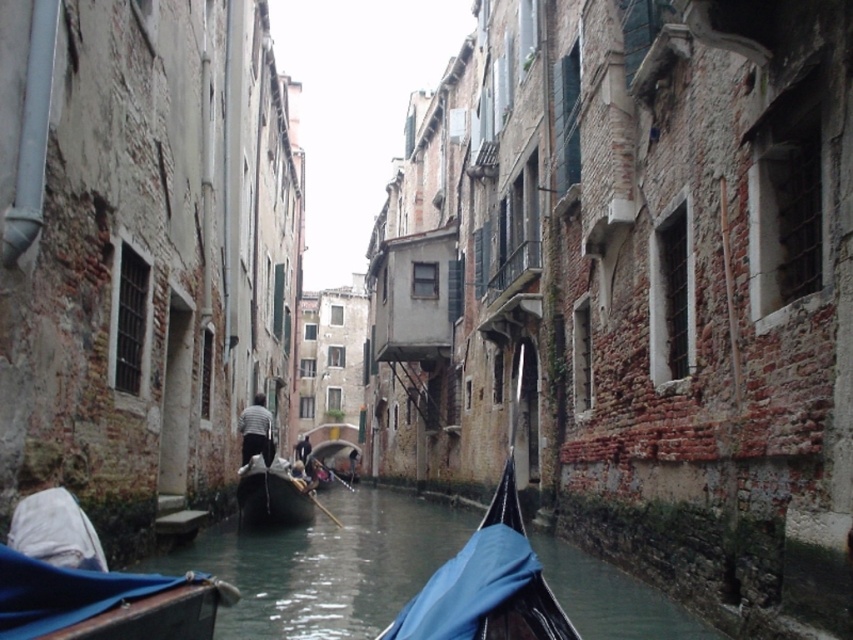
Question: Considering the real-world distances, which object is closest to the striped fabric shirt at center?

Choices:
 (A) blue fabric-covered boat at center
 (B) blue fabric boat at lower center
 (C) wooden gondola at center

Answer: (C)

Question: Can you confirm if white cloth at lower left is smaller than striped fabric shirt at center?

Choices:
 (A) yes
 (B) no

Answer: (A)

Question: Which point is closer to the camera?

Choices:
 (A) (251, 468)
 (B) (257, 432)
 (C) (85, 547)

Answer: (C)

Question: Is blue fabric-covered boat at center bigger than white cloth at lower left?

Choices:
 (A) no
 (B) yes

Answer: (B)

Question: Which point is farther to the camera?

Choices:
 (A) blue fabric-covered boat at center
 (B) wooden gondola at center

Answer: (B)

Question: In this image, where is blue fabric boat at lower center located relative to striped fabric shirt at center?

Choices:
 (A) below
 (B) above

Answer: (B)